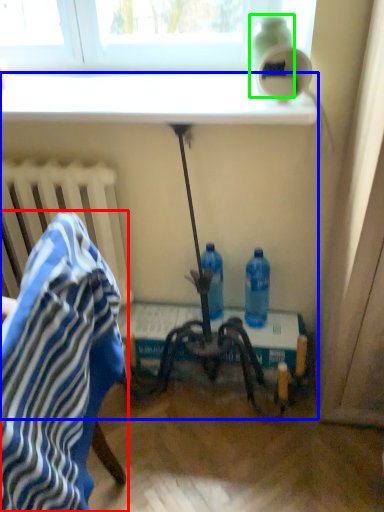
Question: Which object is the closest to the chair (highlighted by a red box)? Choose among these: table (highlighted by a blue box) or bottle (highlighted by a green box).

Choices:
 (A) table
 (B) bottle

Answer: (A)